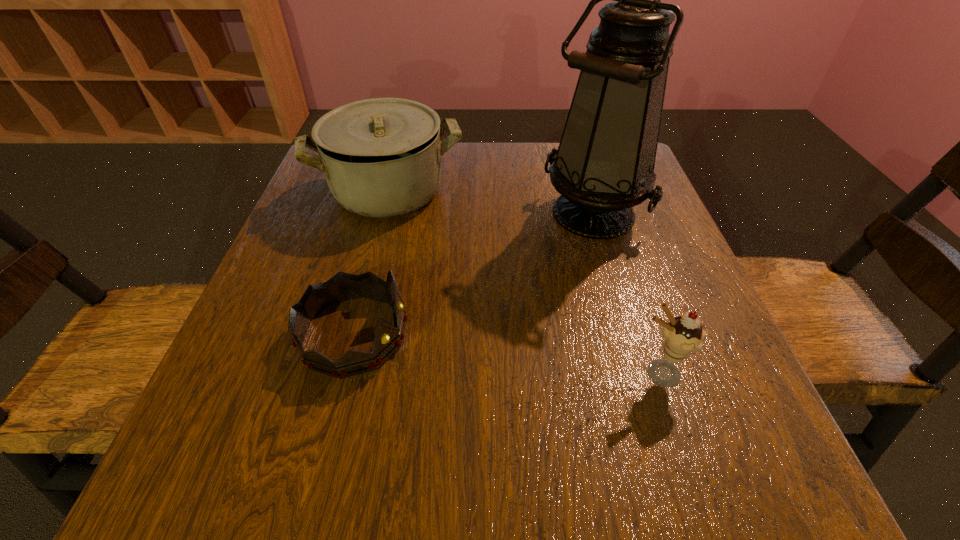
You are a GUI agent. You are given a task and a screenshot of the screen. Output one action in this format:
    pyautogui.click(x=<x>, y=<y>)
    Task: Click on the vacant space that is in between the saucepan and the icecream
    
    Given the screenshot: What is the action you would take?
    pyautogui.click(x=523, y=282)

The width and height of the screenshot is (960, 540). Identify the location of free space that is in between the icecream and the saucepan. (523, 282).

This screenshot has width=960, height=540. I want to click on object that is the closest to the oil lamp, so [381, 157].

The height and width of the screenshot is (540, 960). In order to click on object that is the third closest to the oil lamp in this screenshot , I will do `click(318, 297)`.

You are a GUI agent. You are given a task and a screenshot of the screen. Output one action in this format:
    pyautogui.click(x=<x>, y=<y>)
    Task: Click on the free location that satisfies the following two spatial constraints: 1. at the front of the icecream with jewels; 2. on the left side of the shortest object
    This screenshot has height=540, width=960.
    Given the screenshot: What is the action you would take?
    pyautogui.click(x=344, y=373)

The height and width of the screenshot is (540, 960). I want to click on vacant area that satisfies the following two spatial constraints: 1. on the front side of the icecream; 2. on the right side of the tallest object, so click(x=639, y=373).